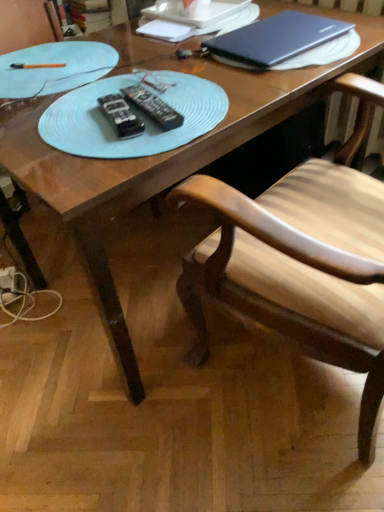
Question: Does wooden chair at center have a lesser height compared to black plastic remote at center, positioned as the 2th remote in left-to-right order?

Choices:
 (A) yes
 (B) no

Answer: (B)

Question: Is wooden chair at center taller than black plastic remote at center, the first remote in the right-to-left sequence?

Choices:
 (A) yes
 (B) no

Answer: (A)

Question: Does wooden chair at center have a greater width compared to black plastic remote at center, positioned as the 2th remote in left-to-right order?

Choices:
 (A) no
 (B) yes

Answer: (B)

Question: Is the depth of wooden chair at center less than that of black plastic remote at center, the first remote in the right-to-left sequence?

Choices:
 (A) no
 (B) yes

Answer: (B)

Question: From a real-world perspective, is wooden chair at center located beneath black plastic remote at center, the first remote in the right-to-left sequence?

Choices:
 (A) no
 (B) yes

Answer: (B)

Question: Considering the positions of wooden chair at center and satin black laptop at upper right in the image, is wooden chair at center taller or shorter than satin black laptop at upper right?

Choices:
 (A) short
 (B) tall

Answer: (B)

Question: From a real-world perspective, is wooden chair at center above or below satin black laptop at upper right?

Choices:
 (A) above
 (B) below

Answer: (B)

Question: Does point (352, 366) appear closer or farther from the camera than point (296, 22)?

Choices:
 (A) farther
 (B) closer

Answer: (B)

Question: From the image's perspective, is wooden chair at center above or below satin black laptop at upper right?

Choices:
 (A) above
 (B) below

Answer: (B)

Question: Looking at their shapes, would you say wooden chair at center is wider or thinner than black plastic remote at center, the first remote positioned from the left?

Choices:
 (A) wide
 (B) thin

Answer: (A)

Question: Is point (288, 266) positioned closer to the camera than point (122, 117)?

Choices:
 (A) farther
 (B) closer

Answer: (A)

Question: From the image's perspective, is wooden chair at center located above or below black plastic remote at center, the first remote positioned from the left?

Choices:
 (A) above
 (B) below

Answer: (B)

Question: Considering their positions, is wooden chair at center located in front of or behind black plastic remote at center, the first remote positioned from the left?

Choices:
 (A) front
 (B) behind

Answer: (A)

Question: Is light blue plastic plate at upper left wider or thinner than black plastic remote at center, the first remote positioned from the left?

Choices:
 (A) thin
 (B) wide

Answer: (B)

Question: Considering the positions of light blue plastic plate at upper left and black plastic remote at center, which is the second remote in right-to-left order, in the image, is light blue plastic plate at upper left bigger or smaller than black plastic remote at center, which is the second remote in right-to-left order,?

Choices:
 (A) small
 (B) big

Answer: (B)